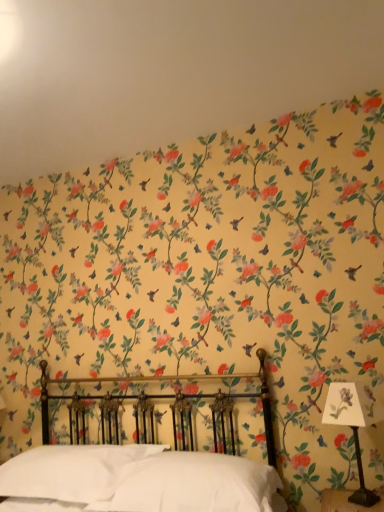
Question: From a real-world perspective, is white soft pillow at center, which is the second pillow from left to right, beneath polished brass bed at center?

Choices:
 (A) no
 (B) yes

Answer: (B)

Question: Can you confirm if white soft pillow at center, the first pillow positioned from the right, is shorter than polished brass bed at center?

Choices:
 (A) no
 (B) yes

Answer: (B)

Question: Does white soft pillow at center, the first pillow positioned from the right, have a greater width compared to polished brass bed at center?

Choices:
 (A) yes
 (B) no

Answer: (B)

Question: From a real-world perspective, is white soft pillow at center, the first pillow positioned from the right, positioned over polished brass bed at center based on gravity?

Choices:
 (A) no
 (B) yes

Answer: (A)

Question: Would you say white soft pillow at center, the first pillow positioned from the right, is outside polished brass bed at center?

Choices:
 (A) no
 (B) yes

Answer: (A)

Question: Is white soft pillow at lower center, which is the second pillow in right-to-left order, wider or thinner than white paper at right?

Choices:
 (A) wide
 (B) thin

Answer: (A)

Question: From a real-world perspective, is white soft pillow at lower center, which is the second pillow in right-to-left order, positioned above or below white paper at right?

Choices:
 (A) above
 (B) below

Answer: (B)

Question: Considering the positions of white soft pillow at lower center, the first pillow from the left, and white paper at right in the image, is white soft pillow at lower center, the first pillow from the left, bigger or smaller than white paper at right?

Choices:
 (A) big
 (B) small

Answer: (A)

Question: In the image, is white soft pillow at lower center, the first pillow from the left, positioned in front of or behind white paper at right?

Choices:
 (A) behind
 (B) front

Answer: (A)

Question: Is polished brass bed at center situated inside floral wallpaper at upper center or outside?

Choices:
 (A) outside
 (B) inside

Answer: (A)

Question: From a real-world perspective, relative to floral wallpaper at upper center, is polished brass bed at center vertically above or below?

Choices:
 (A) above
 (B) below

Answer: (B)

Question: Based on their sizes in the image, would you say polished brass bed at center is bigger or smaller than floral wallpaper at upper center?

Choices:
 (A) big
 (B) small

Answer: (A)

Question: From the image's perspective, is polished brass bed at center located above or below floral wallpaper at upper center?

Choices:
 (A) above
 (B) below

Answer: (B)

Question: From the image's perspective, relative to polished brass bed at center, is white soft pillow at lower center, which is the second pillow in right-to-left order, above or below?

Choices:
 (A) above
 (B) below

Answer: (B)

Question: Relative to polished brass bed at center, is white soft pillow at lower center, which is the second pillow in right-to-left order, in front or behind?

Choices:
 (A) behind
 (B) front

Answer: (A)